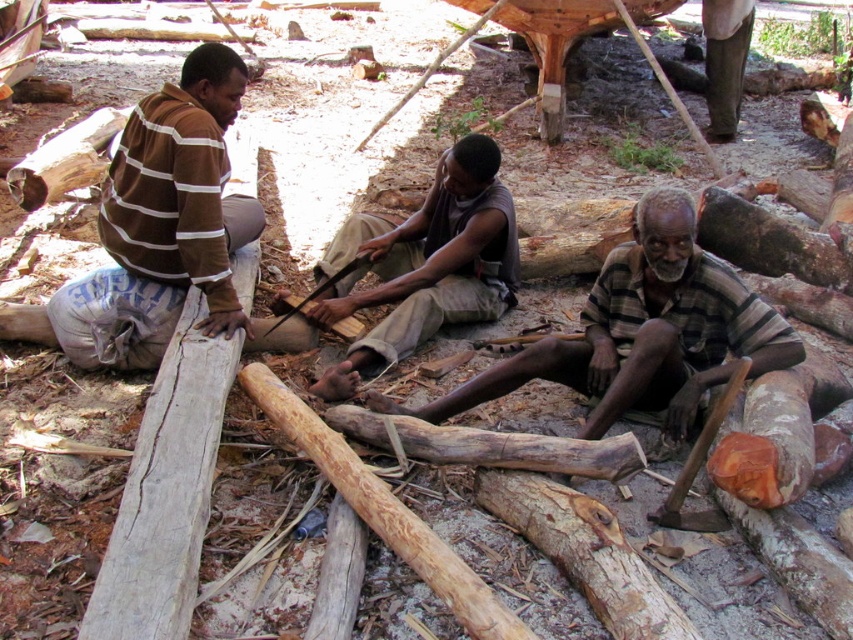
You are a photographer standing in front of the scene. You want to capture a photo that includes both the brown striped sweater at left and the smooth brown wood at center. Which object should you focus on first to ensure both are in frame?

The brown striped sweater at left is located above smooth brown wood at center, so you should focus on the smooth brown wood at center first to ensure both are in frame.

You are a photographer trying to capture a closeup of the brown striped sweater at left and the striped fabric shirt at center. Which one is positioned higher in the image?

The brown striped sweater at left is located above the striped fabric shirt at center, so it is positioned higher in the image.

You are a photographer trying to capture a group photo of the two people in the scene. You want to arrange them so that the person in the brown striped sweater at left is positioned to the right of the striped fabric shirt at center. Is this possible based on their current positions?

The brown striped sweater at left is currently to the left of the striped fabric shirt at center, so rearranging them would require moving the brown striped sweater at left to the right side of the striped fabric shirt at center, which is possible if they can shift their positions.